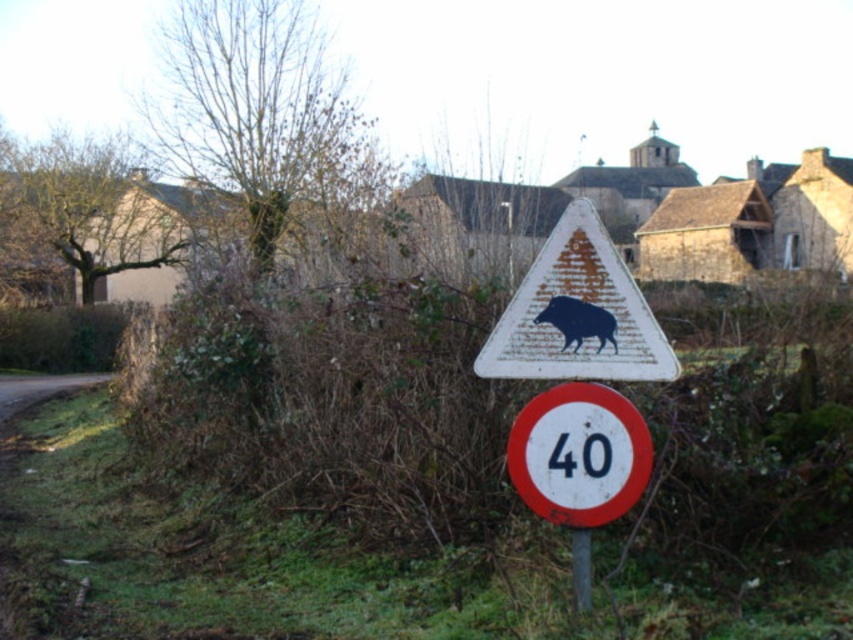
Question: Which of the following is the closest to the observer?

Choices:
 (A) (645, 332)
 (B) (549, 321)

Answer: (A)

Question: Can you confirm if dark matte boar at center is positioned below metallic pole at center?

Choices:
 (A) yes
 (B) no

Answer: (B)

Question: Among these points, which one is farthest from the camera?

Choices:
 (A) (582, 548)
 (B) (590, 452)
 (C) (561, 346)
 (D) (599, 248)

Answer: (D)

Question: Is white textured triangle at center to the right of dark matte boar at center from the viewer's perspective?

Choices:
 (A) no
 (B) yes

Answer: (A)

Question: Among these objects, which one is nearest to the camera?

Choices:
 (A) metallic pole at center
 (B) white metallic number at center
 (C) white textured triangle at center
 (D) dark matte boar at center

Answer: (C)

Question: Considering the relative positions of dark matte boar at center and metallic pole at center in the image provided, where is dark matte boar at center located with respect to metallic pole at center?

Choices:
 (A) above
 (B) below

Answer: (A)